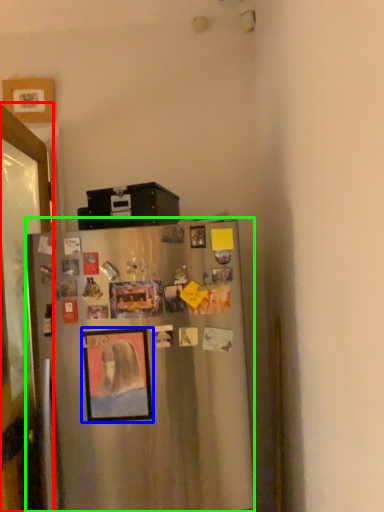
Question: Which is farther away from glass door (highlighted by a red box)? picture frame (highlighted by a blue box) or refrigerator (highlighted by a green box)?

Choices:
 (A) picture frame
 (B) refrigerator

Answer: (B)